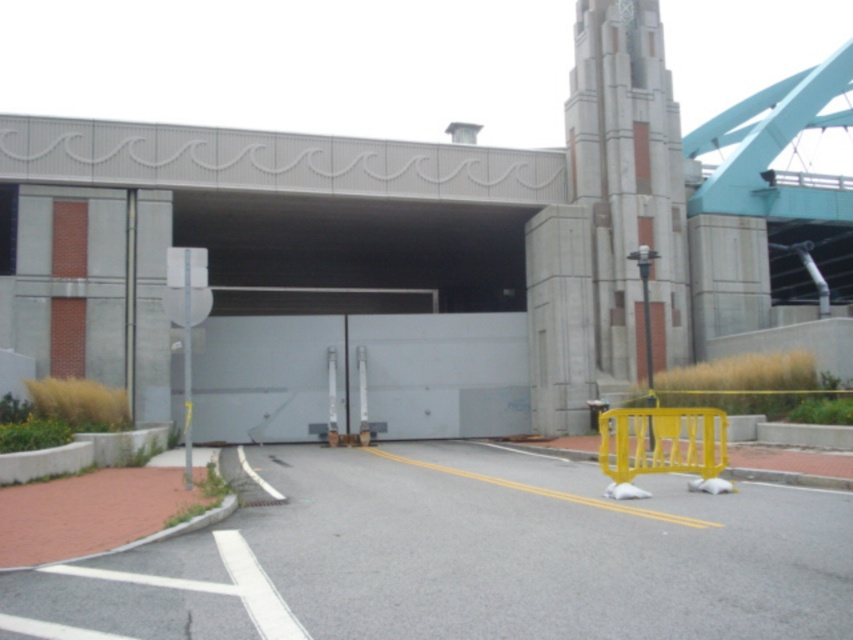
Question: Among these objects, which one is nearest to the camera?

Choices:
 (A) gray concrete parking garage at center
 (B) yellow plastic barricade at lower right

Answer: (B)

Question: Does gray concrete parking garage at center have a larger size compared to yellow plastic barricade at lower right?

Choices:
 (A) yes
 (B) no

Answer: (A)

Question: Does gray concrete parking garage at center appear under yellow plastic barricade at lower right?

Choices:
 (A) no
 (B) yes

Answer: (A)

Question: From the image, what is the correct spatial relationship of gray concrete parking garage at center in relation to yellow plastic barricade at lower right?

Choices:
 (A) left
 (B) right

Answer: (A)